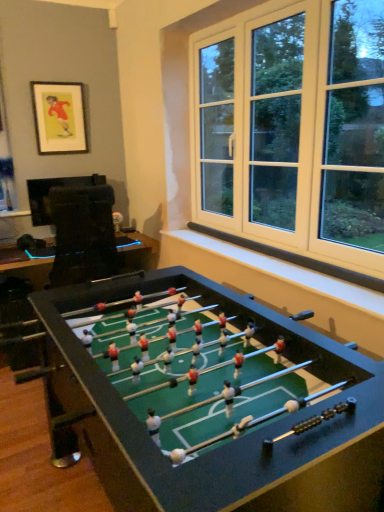
Question: Does black glossy tv at left, positioned as the 1th table in top-to-bottom order, have a lesser height compared to green felt table at center, the second table viewed from the top?

Choices:
 (A) yes
 (B) no

Answer: (B)

Question: Is black glossy tv at left, the 2th table from the bottom, bigger than green felt table at center, the second table viewed from the top?

Choices:
 (A) no
 (B) yes

Answer: (A)

Question: Is green felt table at center, the first table in the bottom-to-top sequence, completely or partially inside black glossy tv at left, the 2th table from the bottom?

Choices:
 (A) no
 (B) yes

Answer: (A)

Question: From the image's perspective, is black glossy tv at left, the 2th table from the bottom, located above green felt table at center, the first table in the bottom-to-top sequence?

Choices:
 (A) yes
 (B) no

Answer: (A)

Question: Considering the relative sizes of black glossy tv at left, the 2th table from the bottom, and green felt table at center, the second table viewed from the top, in the image provided, is black glossy tv at left, the 2th table from the bottom, wider than green felt table at center, the second table viewed from the top,?

Choices:
 (A) no
 (B) yes

Answer: (A)

Question: In terms of height, does green felt table at center, the first table in the bottom-to-top sequence, look taller or shorter compared to matte black picture frame at upper left?

Choices:
 (A) short
 (B) tall

Answer: (A)

Question: Is green felt table at center, the first table in the bottom-to-top sequence, wider or thinner than matte black picture frame at upper left?

Choices:
 (A) thin
 (B) wide

Answer: (B)

Question: Do you think green felt table at center, the first table in the bottom-to-top sequence, is within matte black picture frame at upper left, or outside of it?

Choices:
 (A) inside
 (B) outside

Answer: (B)

Question: From the image's perspective, is green felt table at center, the second table viewed from the top, above or below matte black picture frame at upper left?

Choices:
 (A) below
 (B) above

Answer: (A)

Question: Considering the positions of black glossy tv at left, the 2th table from the bottom, and matte black picture frame at upper left in the image, is black glossy tv at left, the 2th table from the bottom, wider or thinner than matte black picture frame at upper left?

Choices:
 (A) thin
 (B) wide

Answer: (B)

Question: In terms of size, does black glossy tv at left, positioned as the 1th table in top-to-bottom order, appear bigger or smaller than matte black picture frame at upper left?

Choices:
 (A) small
 (B) big

Answer: (B)

Question: Considering their positions, is black glossy tv at left, the 2th table from the bottom, located in front of or behind matte black picture frame at upper left?

Choices:
 (A) front
 (B) behind

Answer: (A)

Question: Is black glossy tv at left, positioned as the 1th table in top-to-bottom order, inside or outside of matte black picture frame at upper left?

Choices:
 (A) outside
 (B) inside

Answer: (A)

Question: Is matte black picture frame at upper left bigger or smaller than green felt table at center, the second table viewed from the top?

Choices:
 (A) big
 (B) small

Answer: (B)

Question: Would you say matte black picture frame at upper left is inside or outside green felt table at center, the second table viewed from the top?

Choices:
 (A) inside
 (B) outside

Answer: (B)